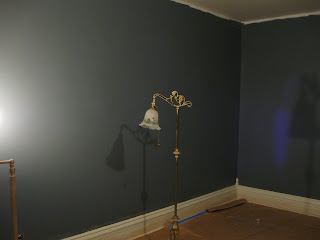
Locate an element on the screen. lamp shadow is located at coordinates (113, 159).